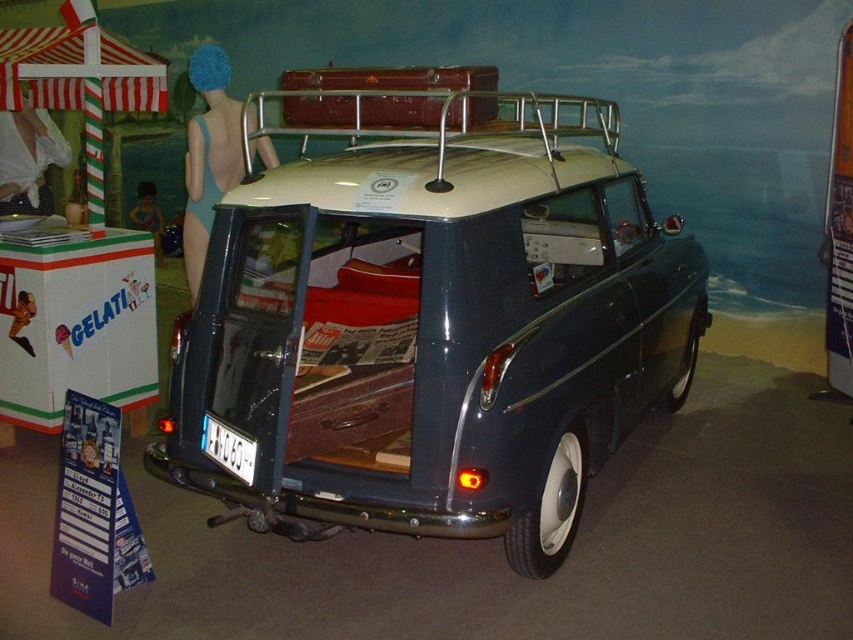
You are a photographer setting up a shoot in the museum. You need to position a large reflector between the shiny dark blue van at center and the blue fabric swimsuit at upper left to bounce light onto the van. Will the reflector, which is 1.8 meters wide, fit between them without overlapping either object?

The shiny dark blue van at center might be wider than blue fabric swimsuit at upper left. Since the reflector is 1.8 meters wide, but we don not know the exact distance between the van and the swimsuit, it is uncertain if the reflector will fit without overlapping. More information is needed to determine this.

Based on the photo, you are standing in front of a vintage car in a museum. You notice two points marked on the car. The first point is at coordinate point[219,100] and the second point is at coordinate point[138,200]. From your perspective, which point is closer to you?

Point[219,100] is in front of point[138,200], so it is closer to you.

You are standing in a museum and see the vintage car with a dark blue body and cream roof. There is a point marked at coordinates (207, 154). What object is located at that point?

The point at coordinates (207, 154) corresponds to the blue swimsuit at left.